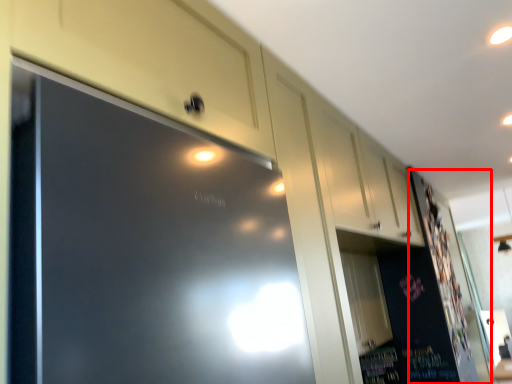
Question: From the image's perspective, considering the relative positions of bulletin board (annotated by the red box) and cabinetry in the image provided, where is bulletin board (annotated by the red box) located with respect to the staircase?

Choices:
 (A) above
 (B) below

Answer: (B)